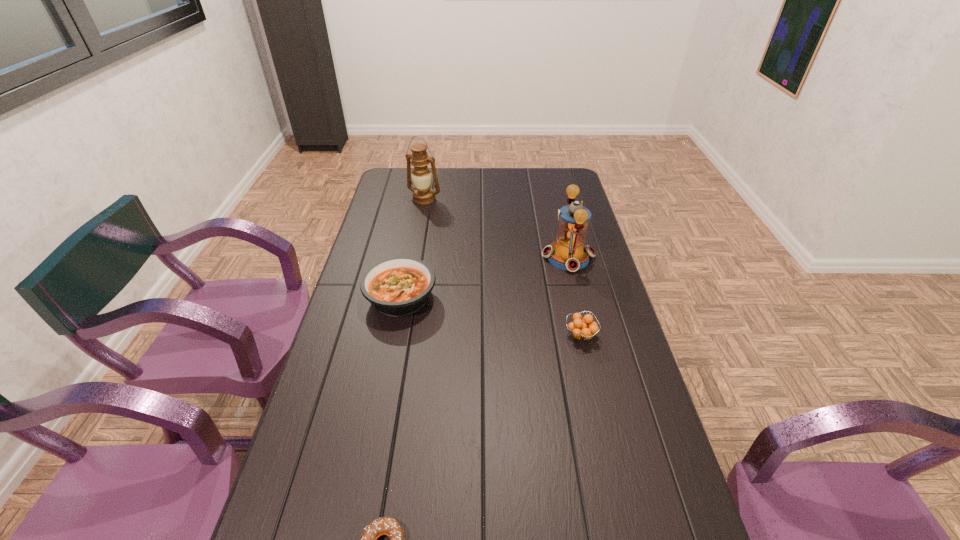
Locate an element on the screen. object positioned at the far edge is located at coordinates (423, 194).

The image size is (960, 540). In order to click on oil lamp at the left edge in this screenshot , I will do `click(423, 194)`.

You are a GUI agent. You are given a task and a screenshot of the screen. Output one action in this format:
    pyautogui.click(x=<x>, y=<y>)
    Task: Click on the stew positioned at the left edge
    The height and width of the screenshot is (540, 960).
    Given the screenshot: What is the action you would take?
    pyautogui.click(x=399, y=286)

Image resolution: width=960 pixels, height=540 pixels. In order to click on lantern situated at the right edge in this screenshot , I will do `click(569, 253)`.

Where is `orange fruit positioned at the right edge`? This screenshot has width=960, height=540. orange fruit positioned at the right edge is located at coordinates (582, 328).

The height and width of the screenshot is (540, 960). Identify the location of object located in the far left corner section of the desktop. tap(423, 194).

In the image, there is a desktop. In order to click on vacant space at the far edge in this screenshot , I will do `click(510, 193)`.

Find the location of a particular element. The height and width of the screenshot is (540, 960). vacant space at the left edge of the desktop is located at coordinates (397, 198).

At what (x,y) coordinates should I click in order to perform the action: click on vacant point at the right edge. Please return your answer as a coordinate pair (x, y). The image size is (960, 540). Looking at the image, I should click on (596, 247).

In the image, there is a desktop. What are the coordinates of `vacant space at the far left corner` in the screenshot? It's located at (384, 179).